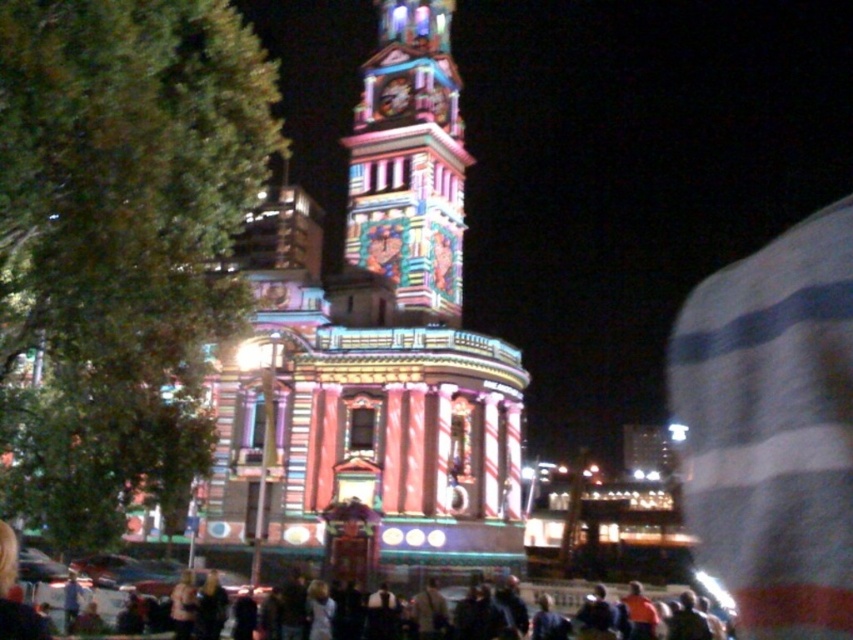
Question: Does multicolored illuminated tower at center appear on the left side of multicolored mosaic clock tower at center?

Choices:
 (A) no
 (B) yes

Answer: (A)

Question: Is multicolored mosaic clock tower at center positioned behind dark clothing crowd at center?

Choices:
 (A) no
 (B) yes

Answer: (B)

Question: Is multicolored illuminated tower at center wider than multicolored mosaic clock tower at center?

Choices:
 (A) no
 (B) yes

Answer: (B)

Question: Which point appears closest to the camera in this image?

Choices:
 (A) (453, 68)
 (B) (230, 580)

Answer: (B)

Question: Which of the following is the closest to the observer?

Choices:
 (A) (381, 353)
 (B) (693, 570)

Answer: (A)

Question: Which of the following is the farthest from the observer?

Choices:
 (A) (329, 324)
 (B) (383, 243)

Answer: (B)